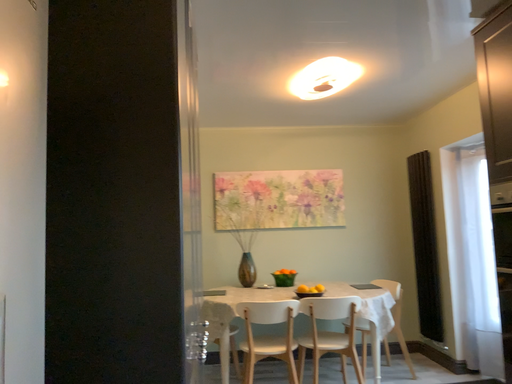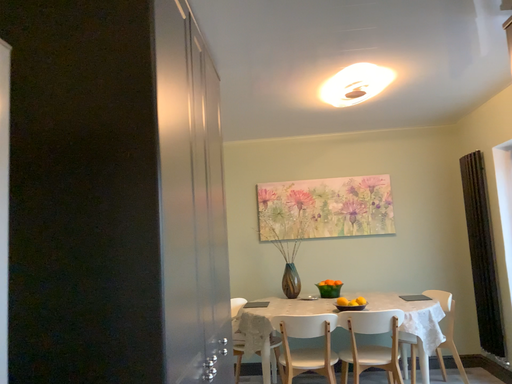
Question: How did the camera likely rotate when shooting the video?

Choices:
 (A) rotated right
 (B) rotated left

Answer: (B)